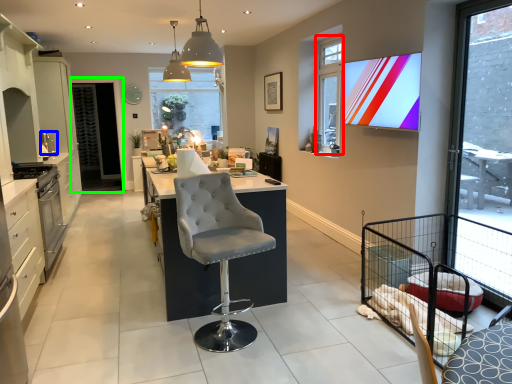
Question: Which object is the closest to the window (highlighted by a red box)? Choose among these: appliance (highlighted by a blue box) or screen door (highlighted by a green box).

Choices:
 (A) appliance
 (B) screen door

Answer: (A)